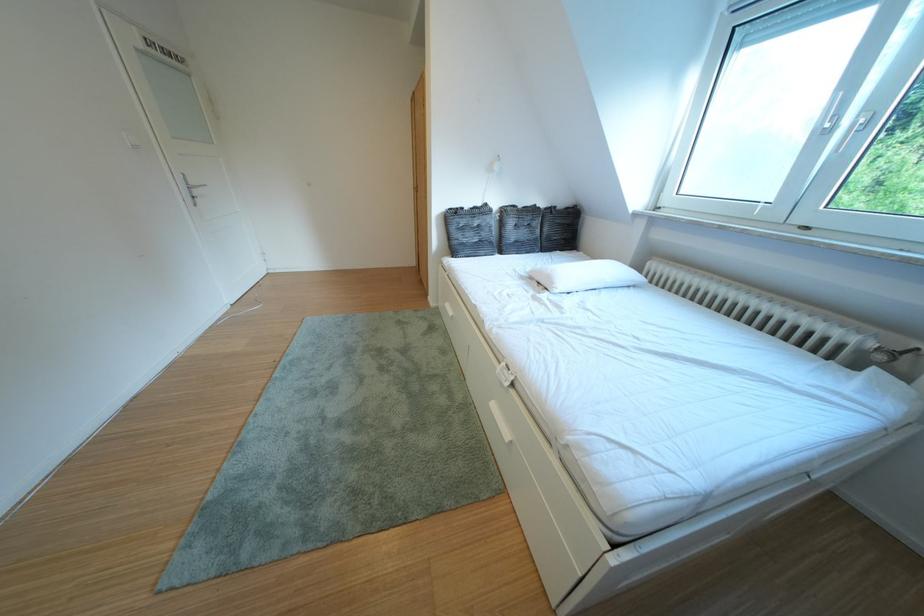
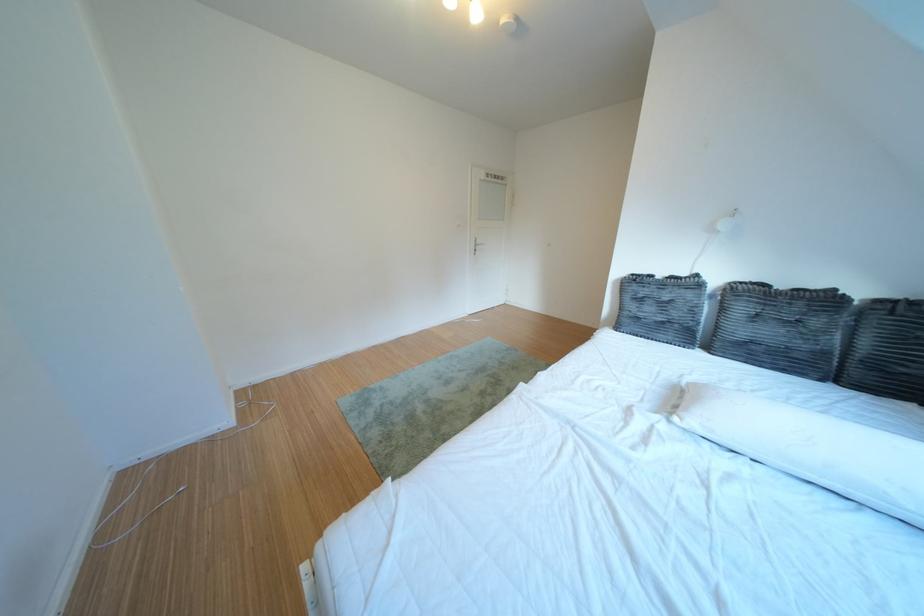
Find the pixel in the second image that matches pixel 574 291 in the first image.

(707, 424)